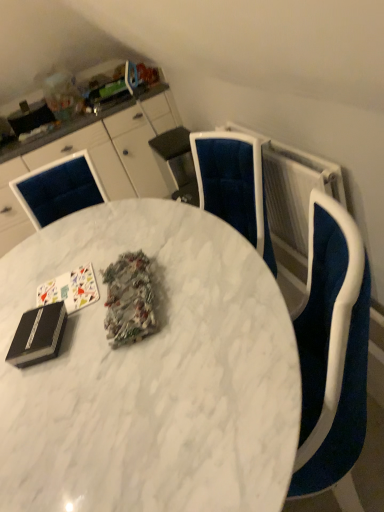
Locate an element on the screen. The height and width of the screenshot is (512, 384). free space between black matte binder at lower left and shiny metallic foil at center is located at coordinates coord(82,317).